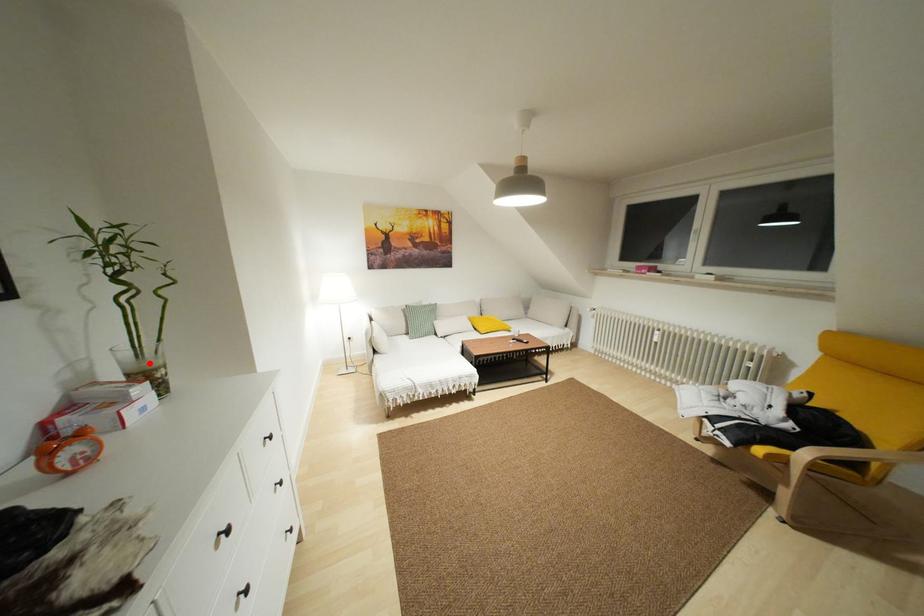
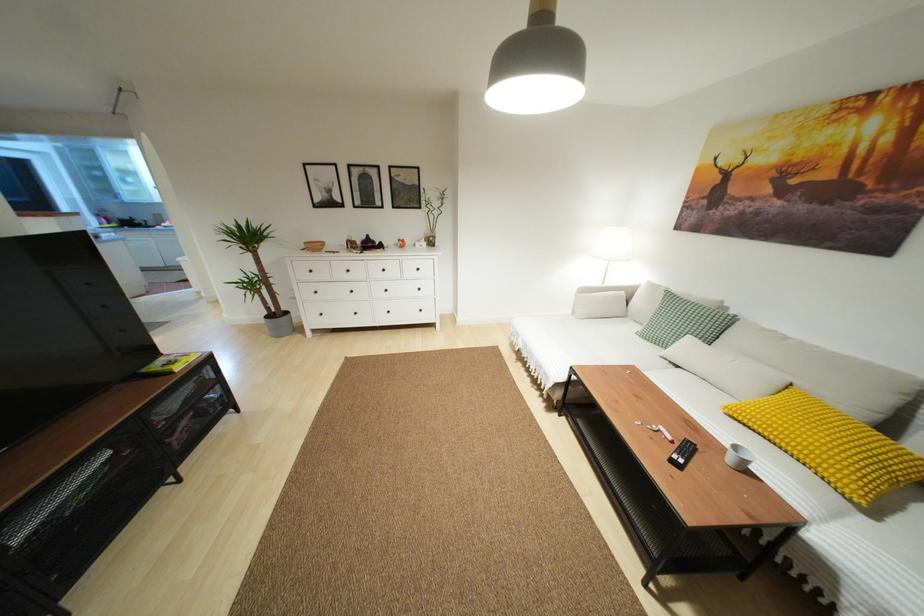
Question: A red point is marked in image1. In image2, is the corresponding 3D point closer to the camera or farther? Reply with the corresponding letter.

Choices:
 (A) The corresponding 3D point is closer.
 (B) The corresponding 3D point is farther.

Answer: (A)